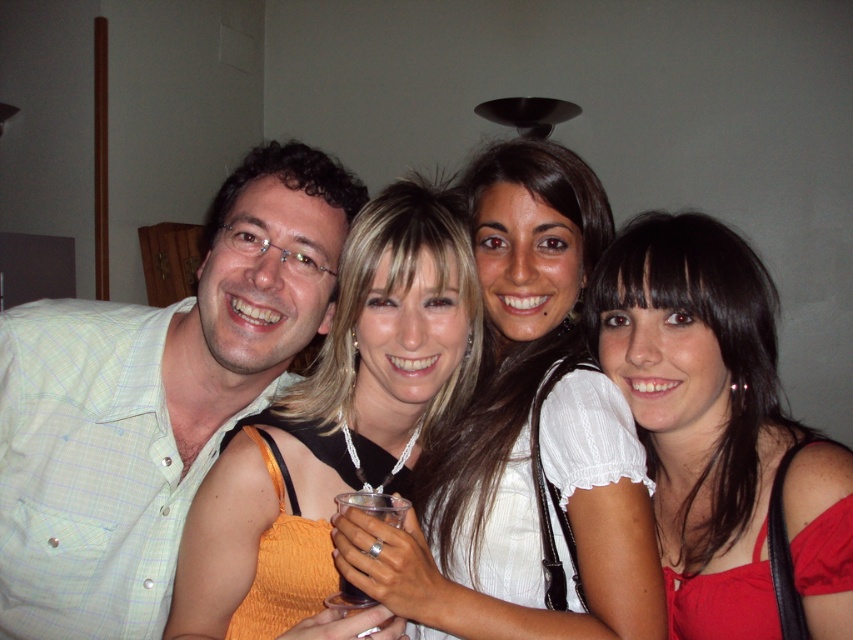
Is matte red dress at lower right positioned at the back of dark translucent plastic cup at center?

Yes, it is behind dark translucent plastic cup at center.

Can you confirm if matte red dress at lower right is taller than dark translucent plastic cup at center?

Yes.

Identify the location of matte red dress at lower right. The image size is (853, 640). (718, 428).

Based on the photo, which of these two, green checkered shirt at left or white satin blouse at center, stands shorter?

Standing shorter between the two is white satin blouse at center.

Which is more to the left, green checkered shirt at left or white satin blouse at center?

green checkered shirt at left

In order to click on green checkered shirt at left in this screenshot , I will do `click(154, 401)`.

Which is in front, point (1, 426) or point (236, 442)?

Positioned in front is point (236, 442).

Is point (41, 552) more distant than point (200, 582)?

That is True.

The width and height of the screenshot is (853, 640). In order to click on green checkered shirt at left in this screenshot , I will do `click(154, 401)`.

Identify the location of green checkered shirt at left. This screenshot has height=640, width=853. (154, 401).